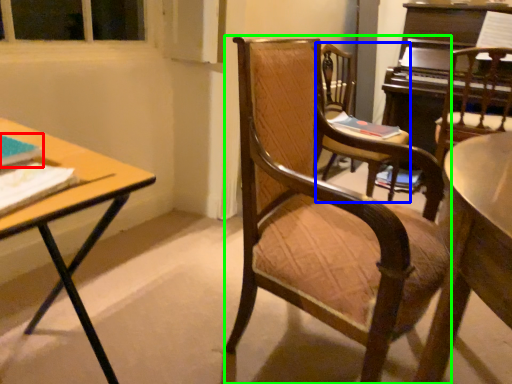
Question: Considering the real-world distances, which object is closest to book (highlighted by a red box)? chair (highlighted by a blue box) or chair (highlighted by a green box).

Choices:
 (A) chair
 (B) chair

Answer: (B)